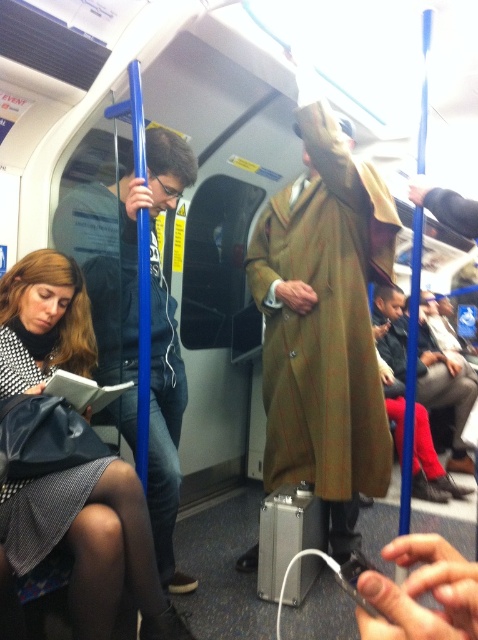
Which of these two, matte black book at lower left or green wool coat at center, stands shorter?

matte black book at lower left

At what (x,y) coordinates should I click in order to perform the action: click on matte black book at lower left. Please return your answer as a coordinate pair (x, y). Looking at the image, I should click on (90, 540).

I want to click on matte black book at lower left, so click(x=90, y=540).

Is point (356, 164) farther from camera compared to point (10, 524)?

Yes, it is behind point (10, 524).

Who is positioned more to the right, brown woolen trench coat at center or matte black book at lower left?

brown woolen trench coat at center

Locate an element on the screen. brown woolen trench coat at center is located at coordinates (324, 320).

Image resolution: width=478 pixels, height=640 pixels. Describe the element at coordinates (324, 320) in the screenshot. I see `brown woolen trench coat at center` at that location.

Is brown woolen trench coat at center positioned before green wool coat at center?

That is True.

Is point (280, 417) farther from camera compared to point (397, 314)?

No, (280, 417) is closer to viewer.

Find the location of a particular element. This screenshot has width=478, height=640. brown woolen trench coat at center is located at coordinates (324, 320).